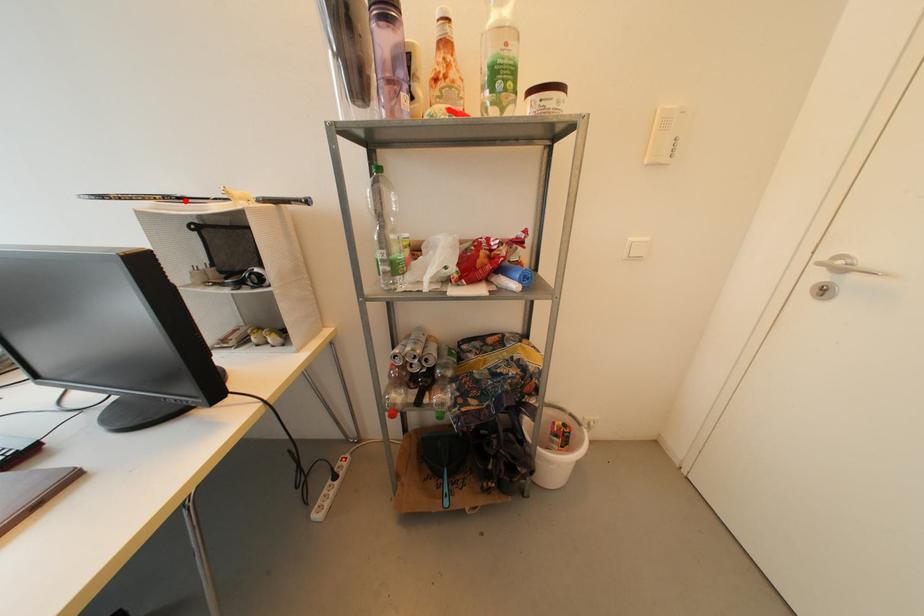
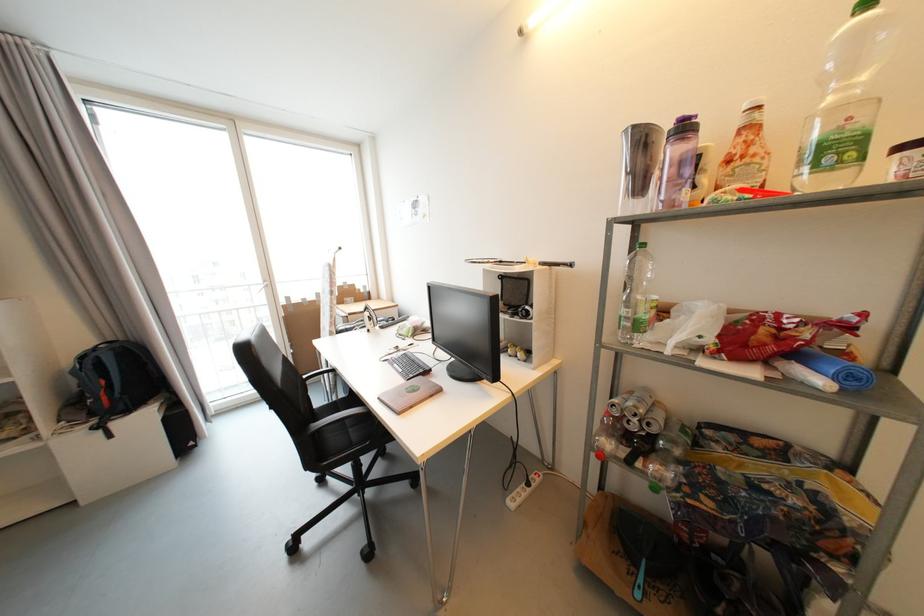
Locate, in the second image, the point that corresponds to the highlighted location in the first image.

(505, 264)